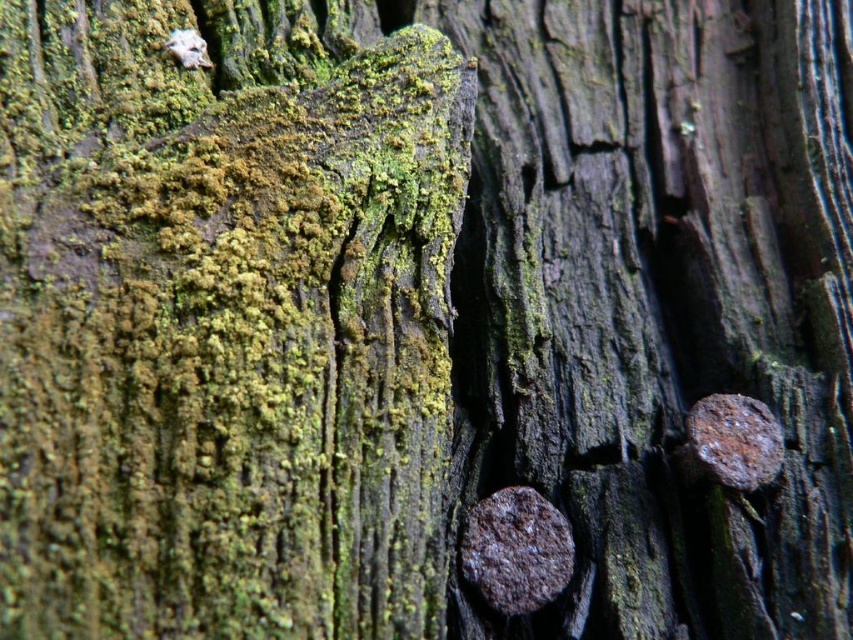
Which is above, rusty metallic nail at lower right or rusty metal nail at right?

rusty metal nail at right is higher up.

Between rusty metallic nail at lower right and rusty metal nail at right, which one appears on the left side from the viewer's perspective?

rusty metallic nail at lower right is more to the left.

The width and height of the screenshot is (853, 640). Describe the element at coordinates (515, 550) in the screenshot. I see `rusty metallic nail at lower right` at that location.

The width and height of the screenshot is (853, 640). What are the coordinates of `rusty metallic nail at lower right` in the screenshot? It's located at (515, 550).